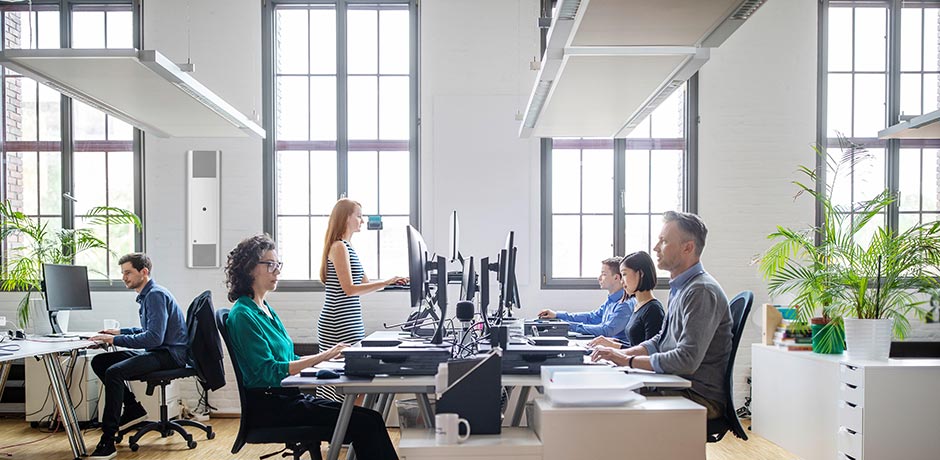
Locate an element on the screen. The width and height of the screenshot is (940, 460). overhead lights hanging from an office ceiling is located at coordinates (605, 101), (645, 26), (930, 130), (134, 99).